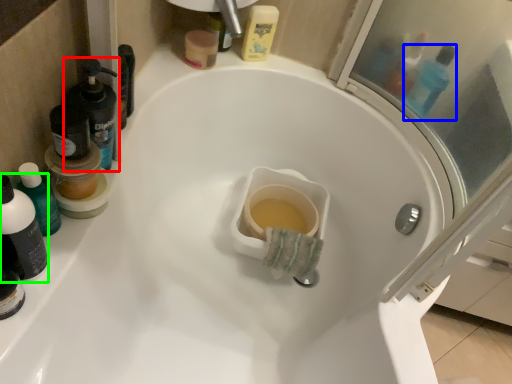
Question: Based on their relative distances, which object is farther from mouthwash (highlighted by a red box)? Choose from mouthwash (highlighted by a blue box) and mouthwash (highlighted by a green box).

Choices:
 (A) mouthwash
 (B) mouthwash

Answer: (A)